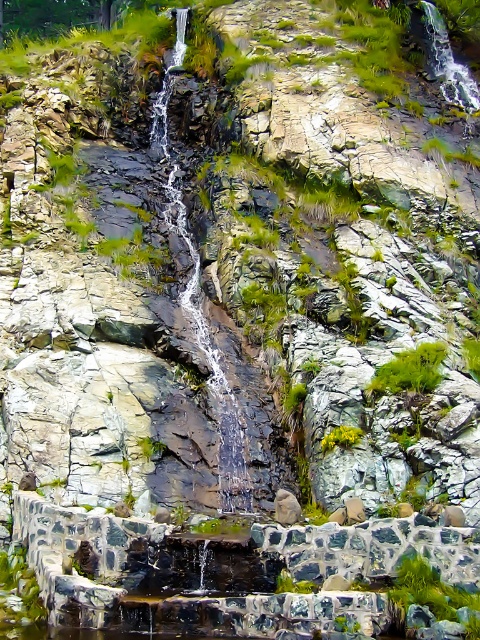
Does clear water at center come behind green leafy plant at center?

No, it is not.

Does clear water at center have a lesser width compared to green leafy plant at center?

No, clear water at center is not thinner than green leafy plant at center.

The width and height of the screenshot is (480, 640). What are the coordinates of `clear water at center` in the screenshot? It's located at (213, 371).

Locate an element on the screen. The image size is (480, 640). clear water at center is located at coordinates (213, 371).